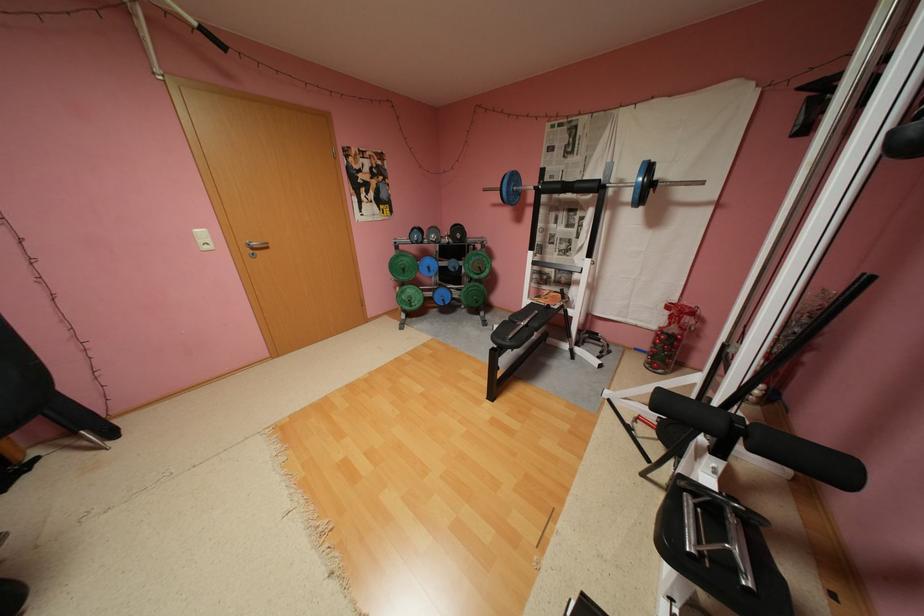
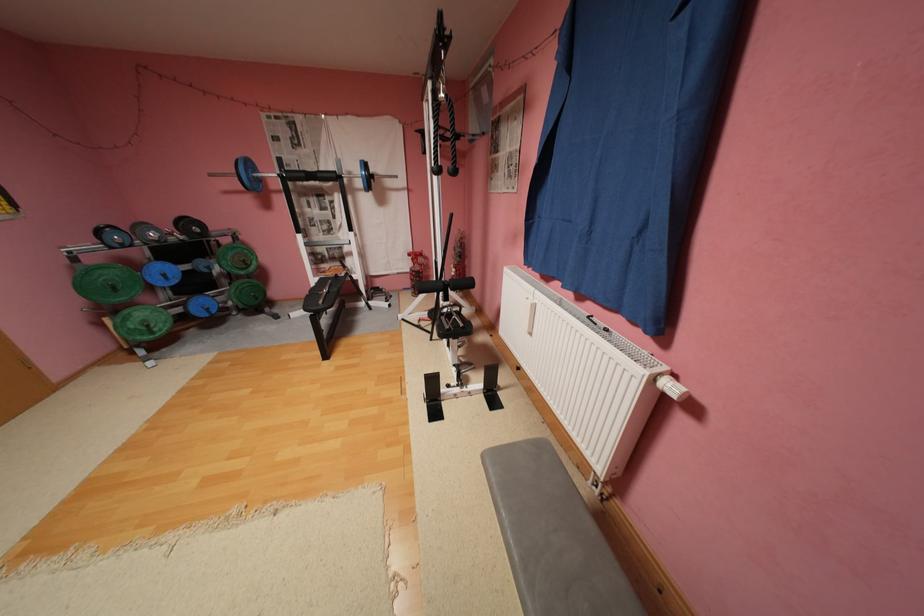
Question: The camera is either moving clockwise (left) or counter-clockwise (right) around the object. The first image is from the beginning of the video and the second image is from the end. Is the camera moving left or right when shooting the video?

Choices:
 (A) Left
 (B) Right

Answer: (A)